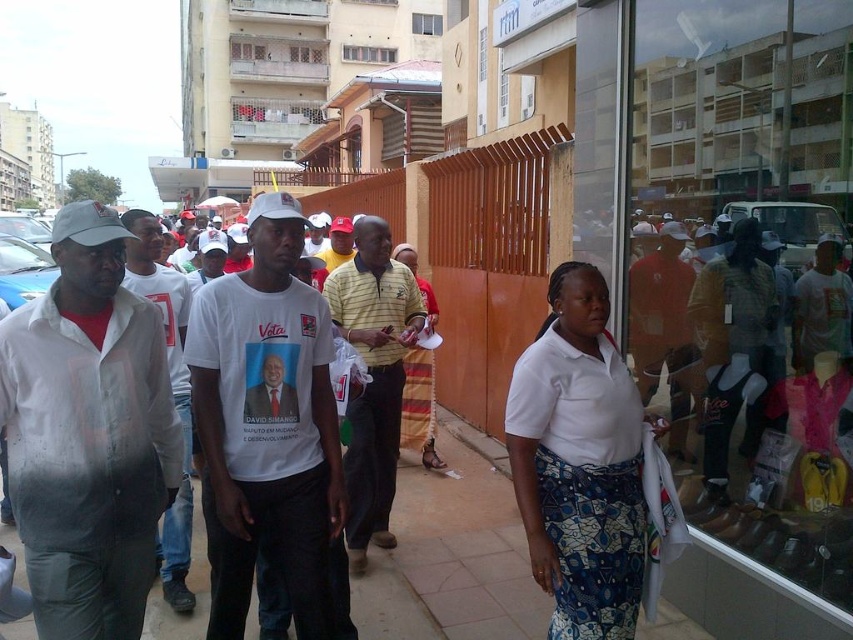
You are standing on the sidewalk in the bustling street scene. You notice two points marked on the ground ahead of you. One is at coordinates point (135, 563) and the other at point (357, 465). Which point is closer to you?

Point (135, 563) is closer to the viewer than point (357, 465).

You are a photographer standing on the sidewalk capturing the scene. You notice the brown concrete pavement at center and the yellow polo shirt at center in your viewfinder. Which object appears taller in the photo?

The yellow polo shirt at center appears taller than the brown concrete pavement at center because the brown concrete pavement at center is shorter than the yellow polo shirt at center.